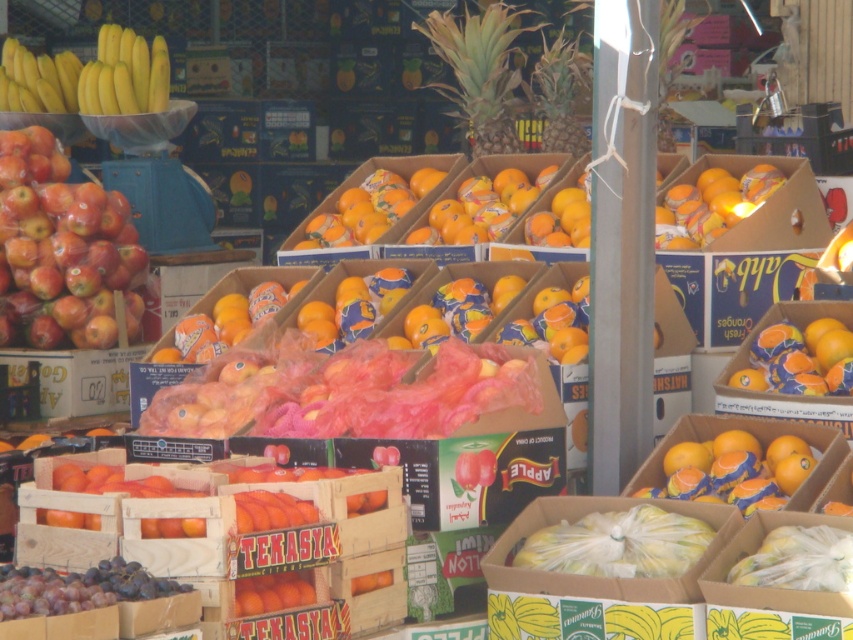
Between shiny red apples at left and yellow matte bananas at upper left, which one is positioned lower?

Positioned lower is shiny red apples at left.

Measure the distance from shiny red apples at left to yellow matte bananas at upper left.

shiny red apples at left is 1.67 meters from yellow matte bananas at upper left.

The height and width of the screenshot is (640, 853). What do you see at coordinates (62, 252) in the screenshot?
I see `shiny red apples at left` at bounding box center [62, 252].

This screenshot has height=640, width=853. Identify the location of shiny red apples at left. [x=62, y=252].